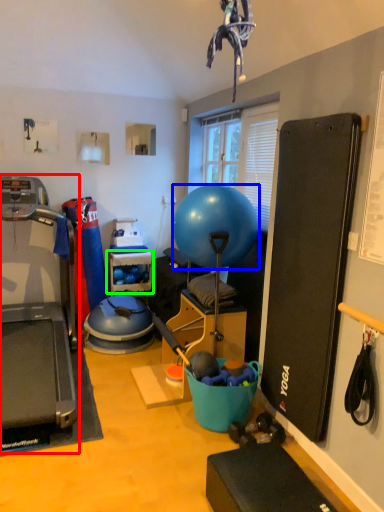
Question: Based on their relative distances, which object is farther from treadmill (highlighted by a red box)? Choose from ball (highlighted by a blue box) and shelf (highlighted by a green box).

Choices:
 (A) ball
 (B) shelf

Answer: (A)